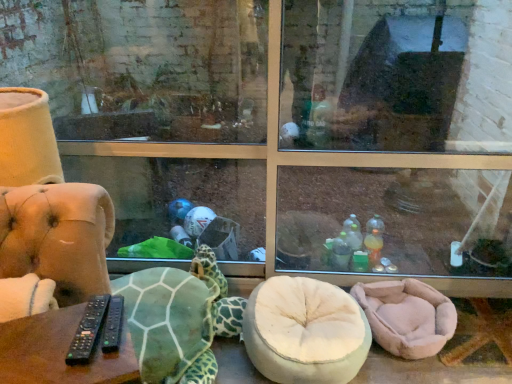
Question: Is pink plush bean bag at lower right wider or thinner than black plastic remotes at lower left?

Choices:
 (A) wide
 (B) thin

Answer: (A)

Question: From the image's perspective, is pink plush bean bag at lower right positioned above or below black plastic remotes at lower left?

Choices:
 (A) above
 (B) below

Answer: (B)

Question: Based on their relative distances, which object is nearer to the green textured fabric tortoise at lower left?

Choices:
 (A) pink plush bean bag at lower right
 (B) black plastic remotes at lower left

Answer: (A)

Question: Based on their relative distances, which object is nearer to the green textured fabric tortoise at lower left?

Choices:
 (A) black plastic remotes at lower left
 (B) pink plush bean bag at lower right

Answer: (B)